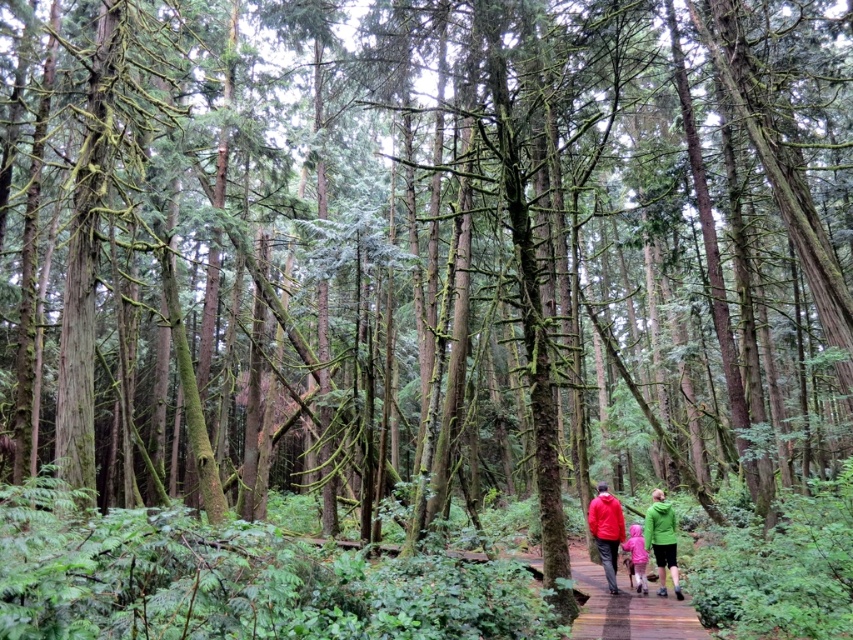
You are a hiker who has just found two jackets on the boardwalk in the forest. You see the red matte jacket at center and the green matte jacket at center. Which jacket is on top?

The red matte jacket at center is positioned over the green matte jacket at center, so the red one is on top.